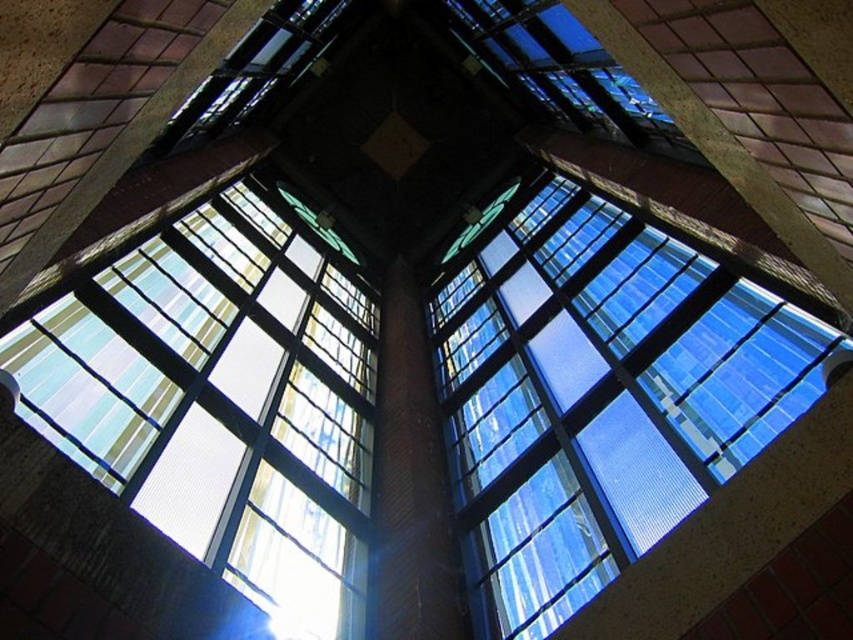
You are standing below the skylight and looking upward. There are two points marked on the glass panes at coordinates point (778, 362) and point (415, 408). Which point is closer to you?

Point (778, 362) is in front of point (415, 408), so it is closer to you.

You are an architect designing a new building and want to ensure that the transparent glass window at upper center and the translucent glass window at upper left are correctly sized according to the building plans. Which window has a smaller width?

The transparent glass window at upper center has a smaller width than the translucent glass window at upper left according to the description.

You are standing below the skylight and want to touch both points marked on the glass panes. Which point, point (202, 412) or point (405, 432), will you reach first as you move upward?

Point (202, 412) is closer to the viewer than point (405, 432), so you will reach point (202, 412) first as you move upward.